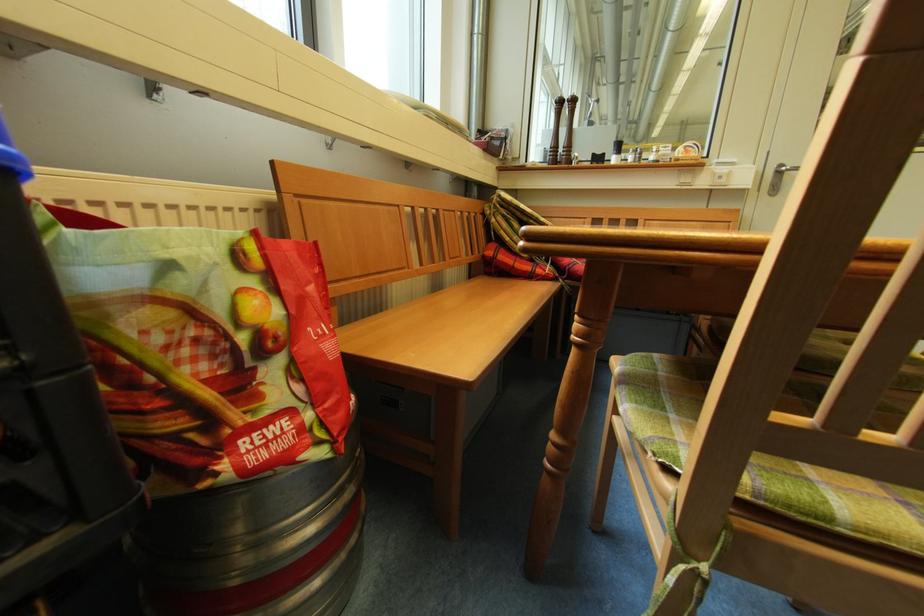
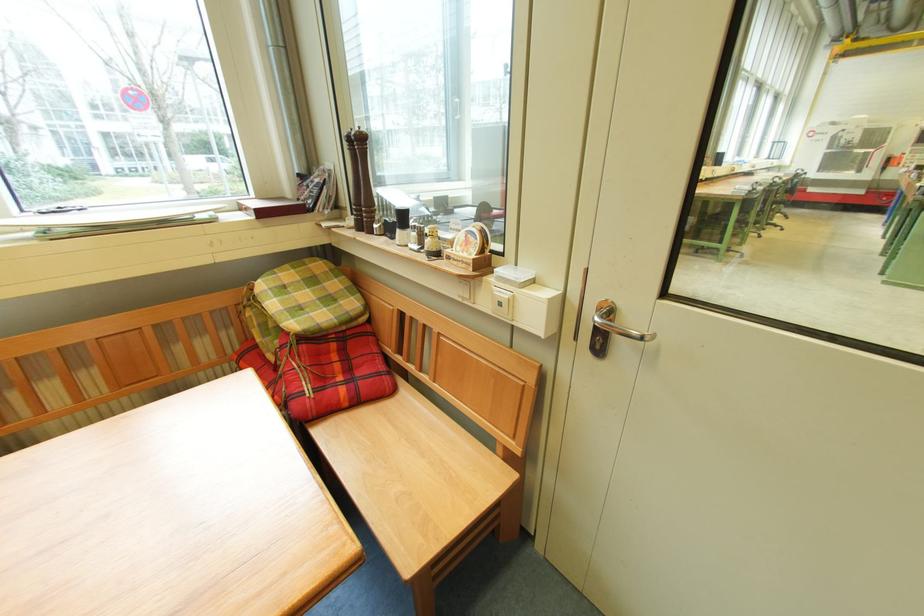
In the second image, find the point that corresponds to (x=564, y=105) in the first image.

(354, 144)